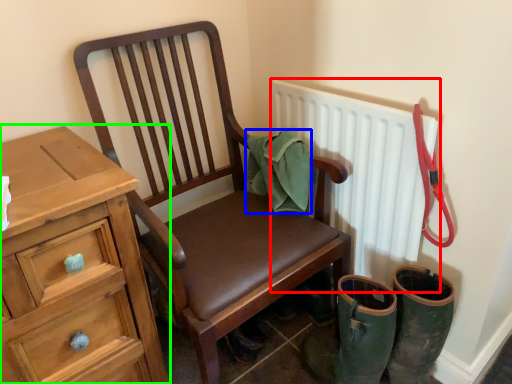
Question: Which object is positioned closest to radiator (highlighted by a red box)? Select from material (highlighted by a blue box) and chest of drawers (highlighted by a green box).

Choices:
 (A) material
 (B) chest of drawers

Answer: (A)